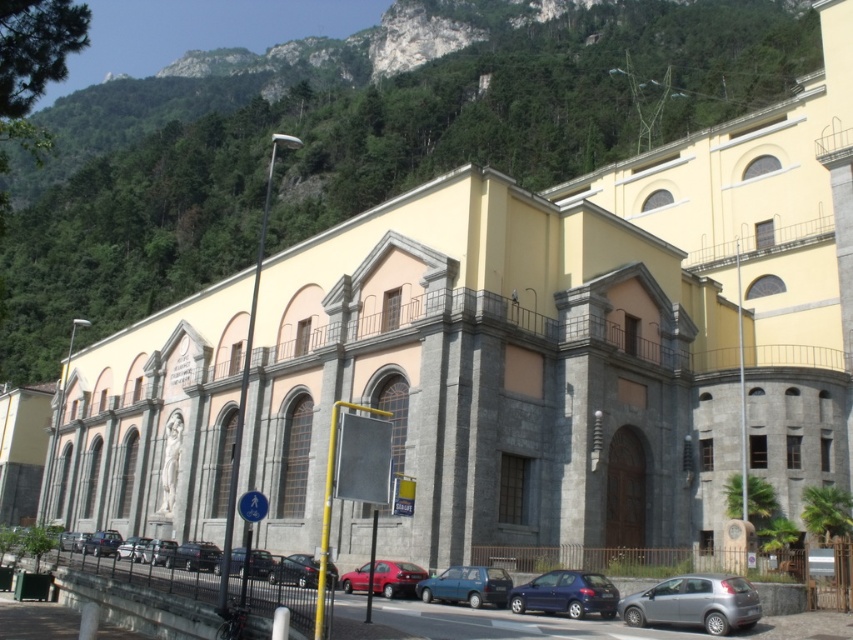
Question: Does matte black car at lower center have a larger size compared to metallic silver car at center?

Choices:
 (A) yes
 (B) no

Answer: (B)

Question: Is metallic blue hatchback at lower right positioned behind metallic silver car at center?

Choices:
 (A) no
 (B) yes

Answer: (A)

Question: Which of the following is the closest to the observer?

Choices:
 (A) silver metallic hatchback at lower right
 (B) metallic blue sedan at center
 (C) metallic silver car at lower center
 (D) metallic blue hatchback at center

Answer: (B)

Question: Does metallic blue hatchback at center have a lesser width compared to metallic silver car at center?

Choices:
 (A) yes
 (B) no

Answer: (A)

Question: Which object appears farthest from the camera in this image?

Choices:
 (A) metallic blue sedan at center
 (B) shiny red car at center
 (C) metallic silver car at lower center
 (D) shiny black sedan at lower left

Answer: (D)

Question: Which object appears closest to the camera in this image?

Choices:
 (A) shiny red car at center
 (B) metallic silver car at center
 (C) matte black car at lower center

Answer: (C)